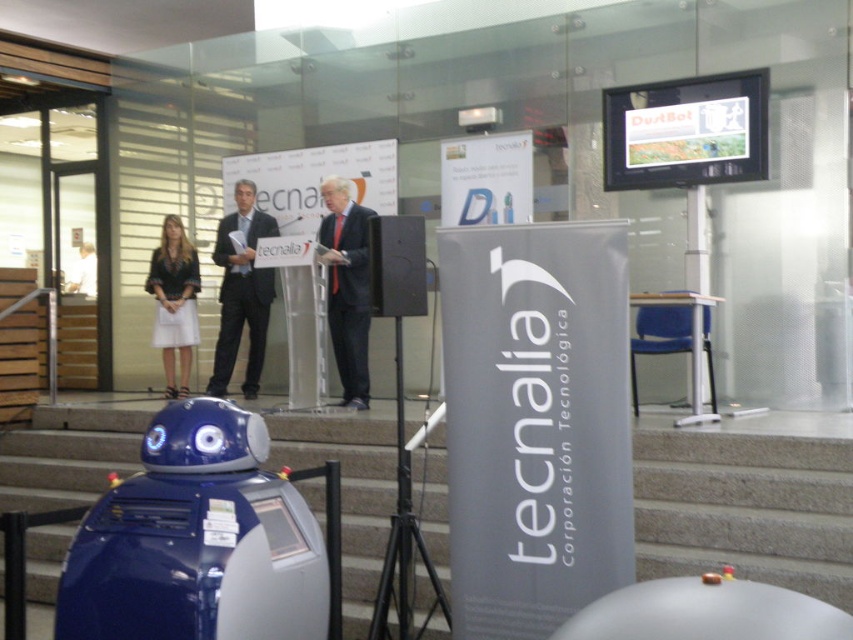
Is concrete stairs at lower center positioned before dark blue suit at center?

Yes, concrete stairs at lower center is closer to the viewer.

Is concrete stairs at lower center below dark blue suit at center?

Indeed, concrete stairs at lower center is positioned under dark blue suit at center.

Does point (428, 515) come closer to viewer compared to point (263, 353)?

Yes, point (428, 515) is closer to viewer.

Find the location of `concrete stairs at lower center`. concrete stairs at lower center is located at coordinates (746, 508).

In the scene shown: Does dark blue suit at center have a lesser height compared to dark gray suit at center?

No, dark blue suit at center is not shorter than dark gray suit at center.

Which is more to the left, dark blue suit at center or dark gray suit at center?

Positioned to the left is dark blue suit at center.

Where is `dark blue suit at center`? dark blue suit at center is located at coordinates (242, 292).

This screenshot has width=853, height=640. What are the coordinates of `dark blue suit at center` in the screenshot? It's located at click(x=242, y=292).

The image size is (853, 640). What do you see at coordinates (349, 296) in the screenshot?
I see `dark gray suit at center` at bounding box center [349, 296].

Does dark gray suit at center lie behind matte black dress at center?

No, dark gray suit at center is closer to the viewer.

Is point (354, 205) positioned in front of point (195, 330)?

Yes, point (354, 205) is closer to viewer.

Where is `dark gray suit at center`? This screenshot has height=640, width=853. dark gray suit at center is located at coordinates (349, 296).